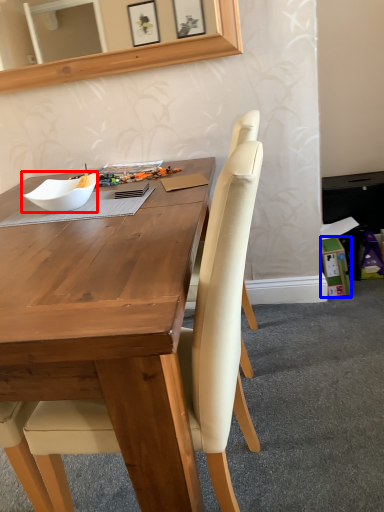
Question: Which object appears farthest to the camera in this image, bowl (highlighted by a red box) or box (highlighted by a blue box)?

Choices:
 (A) bowl
 (B) box

Answer: (B)